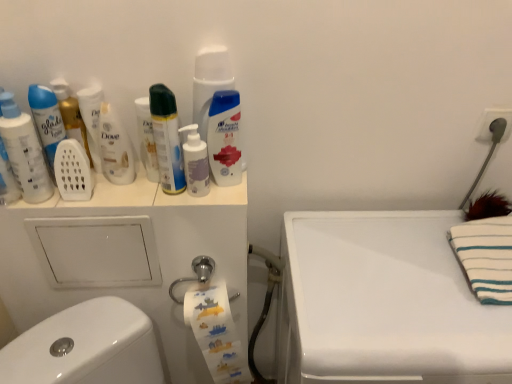
Question: Does white glossy counter top at upper right have a greater width compared to white matte plastic mouthwash at upper left, arranged as the fourth mouthwash when viewed from the right?

Choices:
 (A) yes
 (B) no

Answer: (A)

Question: Can you confirm if white glossy counter top at upper right is smaller than white matte plastic mouthwash at upper left, arranged as the fourth mouthwash when viewed from the right?

Choices:
 (A) no
 (B) yes

Answer: (A)

Question: Is white matte plastic mouthwash at upper left, placed as the 3th mouthwash when sorted from left to right, located within white glossy counter top at upper right?

Choices:
 (A) yes
 (B) no

Answer: (B)

Question: Can you confirm if white glossy counter top at upper right is taller than white matte plastic mouthwash at upper left, placed as the 3th mouthwash when sorted from left to right?

Choices:
 (A) no
 (B) yes

Answer: (B)

Question: Does white glossy counter top at upper right have a lesser width compared to white matte plastic mouthwash at upper left, placed as the 3th mouthwash when sorted from left to right?

Choices:
 (A) yes
 (B) no

Answer: (B)

Question: From a real-world perspective, relative to white matte pump bottle at center, the fifth mouthwash viewed from the left, is white matte plastic mouthwash at upper left, arranged as the fourth mouthwash when viewed from the right, vertically above or below?

Choices:
 (A) below
 (B) above

Answer: (B)

Question: In terms of height, does white matte plastic mouthwash at upper left, placed as the 3th mouthwash when sorted from left to right, look taller or shorter compared to white matte pump bottle at center, marked as the 2th mouthwash in a right-to-left arrangement?

Choices:
 (A) short
 (B) tall

Answer: (B)

Question: From the image's perspective, is white matte plastic mouthwash at upper left, arranged as the fourth mouthwash when viewed from the right, positioned above or below white matte pump bottle at center, marked as the 2th mouthwash in a right-to-left arrangement?

Choices:
 (A) above
 (B) below

Answer: (A)

Question: In the image, is white matte plastic mouthwash at upper left, arranged as the fourth mouthwash when viewed from the right, on the left side or the right side of white matte pump bottle at center, the fifth mouthwash viewed from the left?

Choices:
 (A) left
 (B) right

Answer: (A)

Question: Is translucent plastic mouthwash at center, positioned as the first mouthwash in right-to-left order, taller or shorter than matte white mouthwash at left, the second mouthwash positioned from the left?

Choices:
 (A) short
 (B) tall

Answer: (B)

Question: Looking at their shapes, would you say translucent plastic mouthwash at center, the sixth mouthwash from the left, is wider or thinner than matte white mouthwash at left, the second mouthwash positioned from the left?

Choices:
 (A) wide
 (B) thin

Answer: (A)

Question: Is translucent plastic mouthwash at center, positioned as the first mouthwash in right-to-left order, situated inside matte white mouthwash at left, the second mouthwash positioned from the left, or outside?

Choices:
 (A) inside
 (B) outside

Answer: (B)

Question: From the image's perspective, is translucent plastic mouthwash at center, positioned as the first mouthwash in right-to-left order, above or below matte white mouthwash at left, arranged as the fifth mouthwash when viewed from the right?

Choices:
 (A) below
 (B) above

Answer: (A)

Question: Looking at the image, does white striped towel at upper right seem bigger or smaller compared to matte white mouthwash at left, the second mouthwash positioned from the left?

Choices:
 (A) big
 (B) small

Answer: (A)

Question: From a real-world perspective, is white striped towel at upper right positioned above or below matte white mouthwash at left, arranged as the fifth mouthwash when viewed from the right?

Choices:
 (A) above
 (B) below

Answer: (B)